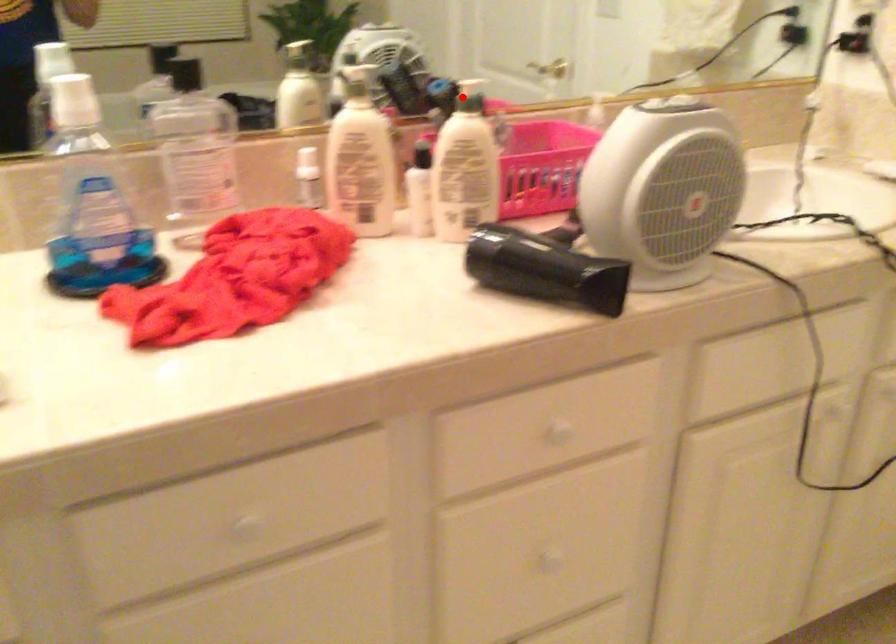
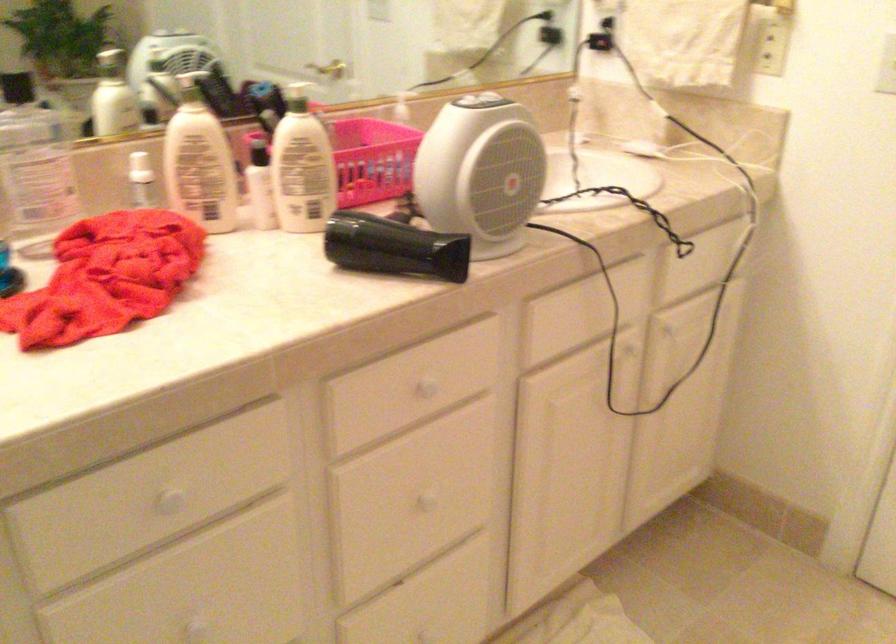
Question: I am providing you with two images of the same scene from different viewpoints. In image1, a red point is highlighted. Considering the same 3D point in image2, which of the following is correct?

Choices:
 (A) It is closer
 (B) It is farther

Answer: (B)